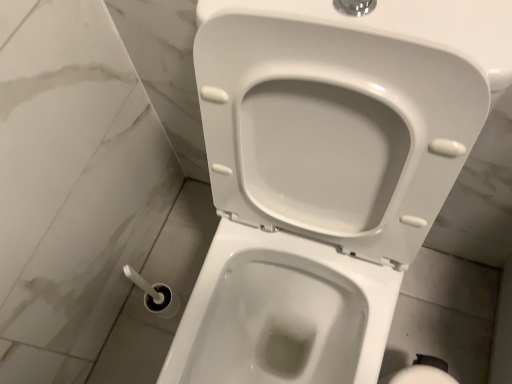
What is the approximate height of white glossy toilet at center?

It is 34.16 inches.

Describe the element at coordinates (326, 174) in the screenshot. I see `white glossy toilet at center` at that location.

Looking at this image, measure the distance between point (323, 168) and camera.

The depth of point (323, 168) is 24.21 inches.

Where is `white glossy toilet at center`? white glossy toilet at center is located at coordinates (326, 174).

Where is `white glossy toilet at center`? The height and width of the screenshot is (384, 512). white glossy toilet at center is located at coordinates click(x=326, y=174).